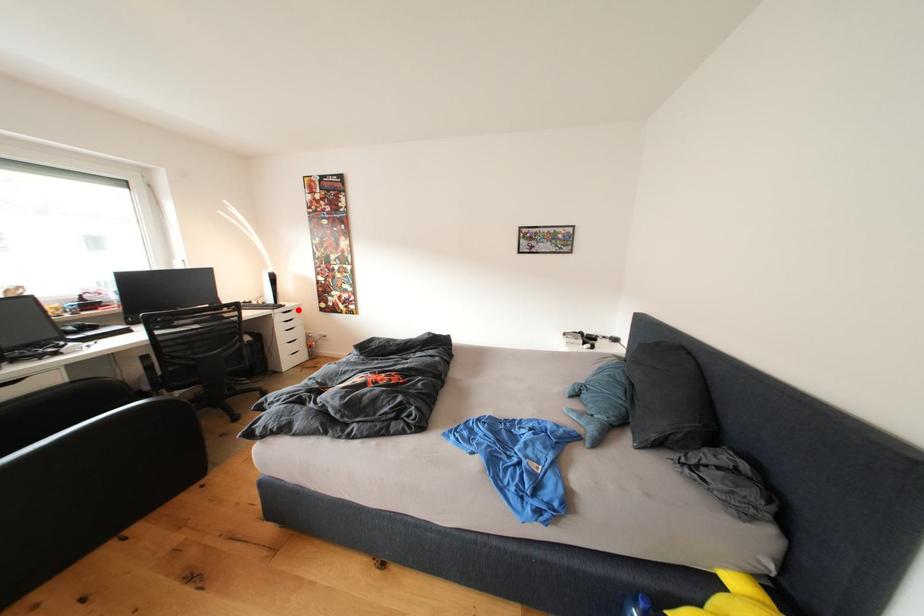
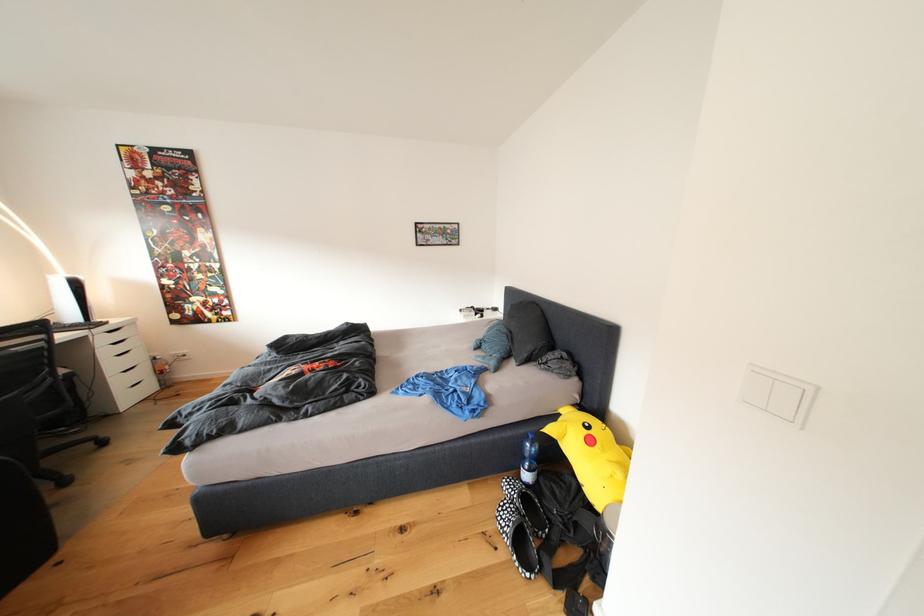
Question: I am providing you with two images of the same scene from different viewpoints. In image1, a red point is highlighted. Considering the same 3D point in image2, which of the following is correct?

Choices:
 (A) It is closer
 (B) It is farther

Answer: (B)